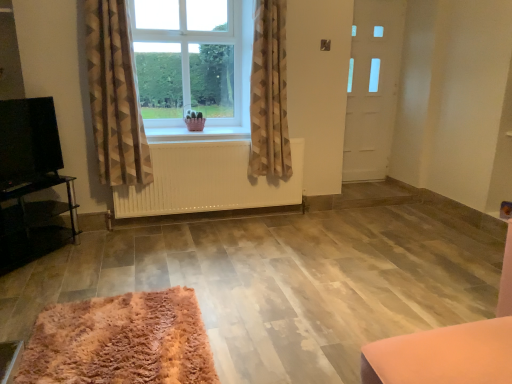
Where is `clear glass window at center`? The width and height of the screenshot is (512, 384). clear glass window at center is located at coordinates (193, 65).

What do you see at coordinates (115, 96) in the screenshot? The image size is (512, 384). I see `beige textured curtain at center, the 1th curtain in the left-to-right sequence` at bounding box center [115, 96].

This screenshot has height=384, width=512. I want to click on white matte radiator at center, so click(207, 181).

Locate an element on the screen. white matte door at right is located at coordinates (372, 87).

What do you see at coordinates (120, 341) in the screenshot?
I see `fluffy pink rug at lower left` at bounding box center [120, 341].

Image resolution: width=512 pixels, height=384 pixels. What do you see at coordinates (269, 93) in the screenshot?
I see `beige textured curtain at center, placed as the first curtain when sorted from right to left` at bounding box center [269, 93].

Measure the distance between point (187,135) and camera.

Point (187,135) is 3.42 meters away from camera.

I want to click on black glossy tv at left, so click(28, 141).

You are a GUI agent. You are given a task and a screenshot of the screen. Output one action in this format:
    pyautogui.click(x=<x>, y=<y>)
    Task: Click on the clear glass window at center
    Image resolution: width=512 pixels, height=384 pixels.
    Given the screenshot: What is the action you would take?
    pyautogui.click(x=193, y=65)

Does point (47, 316) appear closer or farther from the camera than point (39, 169)?

Clearly, point (47, 316) is closer to the camera than point (39, 169).

From the image's perspective, between fluffy pink rug at lower left and black glossy tv at left, who is located below?

fluffy pink rug at lower left is shown below in the image.

Is fluffy pink rug at lower left oriented towards black glossy tv at left?

No, fluffy pink rug at lower left is not aimed at black glossy tv at left.

I want to click on window that appears above the white matte radiator at center (from the image's perspective), so click(193, 65).

From their relative heights in the image, would you say clear glass window at center is taller or shorter than white matte radiator at center?

Clearly, clear glass window at center is taller compared to white matte radiator at center.

From the image's perspective, is clear glass window at center on white matte radiator at center?

Yes.

Consider the image. Is clear glass window at center not near white matte radiator at center?

clear glass window at center is actually quite close to white matte radiator at center.

Is beige textured curtain at center, the 1th curtain in the left-to-right sequence, oriented away from clear glass window at center?

No, beige textured curtain at center, the 1th curtain in the left-to-right sequence,'s orientation is not away from clear glass window at center.

How different are the orientations of beige textured curtain at center, marked as the 2th curtain in a right-to-left arrangement, and clear glass window at center in degrees?

The angular difference between beige textured curtain at center, marked as the 2th curtain in a right-to-left arrangement, and clear glass window at center is 0.572 degrees.

Which of these two, beige textured curtain at center, marked as the 2th curtain in a right-to-left arrangement, or clear glass window at center, is smaller?

clear glass window at center.

The image size is (512, 384). What are the coordinates of `furniture below the white matte door at right (from a real-world perspective)` in the screenshot? It's located at (35, 223).

From the image's perspective, which one is positioned lower, white matte door at right or black glossy tv stand at left?

black glossy tv stand at left is shown below in the image.

Is white matte door at right surrounding black glossy tv stand at left?

No, black glossy tv stand at left is not surrounded by white matte door at right.

Does point (144, 77) appear closer or farther from the camera than point (195, 370)?

Point (144, 77) appears to be farther away from the viewer than point (195, 370).

Which of these two, clear glass window at center or fluffy pink rug at lower left, is thinner?

clear glass window at center.

Can you confirm if clear glass window at center is shorter than fluffy pink rug at lower left?

Incorrect, the height of clear glass window at center does not fall short of that of fluffy pink rug at lower left.

Looking at this image, from the image's perspective, which object appears higher, clear glass window at center or fluffy pink rug at lower left?

clear glass window at center is shown above in the image.

From the image's perspective, is white matte door at right located above or below beige textured curtain at center, placed as the first curtain when sorted from right to left?

white matte door at right is situated higher than beige textured curtain at center, placed as the first curtain when sorted from right to left, in the image.

Is white matte door at right facing towards beige textured curtain at center, the 2th curtain from the left?

No, white matte door at right is not oriented towards beige textured curtain at center, the 2th curtain from the left.

Is white matte door at right with beige textured curtain at center, placed as the first curtain when sorted from right to left?

No, white matte door at right is not in contact with beige textured curtain at center, placed as the first curtain when sorted from right to left.

Is beige textured curtain at center, the 2th curtain from the left, inside white matte door at right?

No, beige textured curtain at center, the 2th curtain from the left, is located outside of white matte door at right.

Which of these two, white matte door at right or clear glass window at center, stands taller?

white matte door at right.

Is white matte door at right turned away from clear glass window at center?

No, white matte door at right is not facing the opposite direction of clear glass window at center.

How many degrees apart are the facing directions of white matte door at right and clear glass window at center?

0.755 degrees separate the facing orientations of white matte door at right and clear glass window at center.

Consider the image. Does white matte door at right have a greater width compared to clear glass window at center?

No.

Find the location of `mat below the black glossy tv at left (from the image's perspective)`. mat below the black glossy tv at left (from the image's perspective) is located at coordinates (120, 341).

Locate an element on the screen. This screenshot has width=512, height=384. radiator below the clear glass window at center (from a real-world perspective) is located at coordinates (207, 181).

From the image, which object appears to be farther from clear glass window at center, white wooden window sill at center or black glossy tv stand at left?

black glossy tv stand at left is positioned further to the anchor clear glass window at center.

Considering their positions, is white wooden window sill at center positioned further to black glossy tv at left than fluffy pink rug at lower left?

fluffy pink rug at lower left is further to black glossy tv at left.

Estimate the real-world distances between objects in this image. Which object is closer to beige textured curtain at center, the 1th curtain in the left-to-right sequence, white matte radiator at center or white wooden window sill at center?

white matte radiator at center lies closer to beige textured curtain at center, the 1th curtain in the left-to-right sequence, than the other object.

Looking at the image, which one is located closer to clear glass window at center, black glossy tv at left or black glossy tv stand at left?

Based on the image, black glossy tv at left appears to be nearer to clear glass window at center.

Considering their positions, is white wooden window sill at center positioned further to beige textured curtain at center, the 2th curtain from the left, than fluffy pink rug at lower left?

fluffy pink rug at lower left lies further to beige textured curtain at center, the 2th curtain from the left, than the other object.

Estimate the real-world distances between objects in this image. Which object is closer to clear glass window at center, beige textured curtain at center, placed as the first curtain when sorted from right to left, or beige textured curtain at center, the 1th curtain in the left-to-right sequence?

Based on the image, beige textured curtain at center, the 1th curtain in the left-to-right sequence, appears to be nearer to clear glass window at center.

From the image, which object appears to be farther from black glossy tv stand at left, beige textured curtain at center, the 2th curtain from the left, or black glossy tv at left?

beige textured curtain at center, the 2th curtain from the left, is positioned further to the anchor black glossy tv stand at left.

Looking at the image, which one is located closer to white matte door at right, black glossy tv at left or fluffy pink rug at lower left?

black glossy tv at left.

This screenshot has height=384, width=512. What are the coordinates of `level between beige textured curtain at center, the 1th curtain in the left-to-right sequence, and black glossy tv stand at left in the up-down direction` in the screenshot? It's located at (28, 141).

Locate an element on the screen. This screenshot has width=512, height=384. window sill situated between clear glass window at center and white matte door at right from left to right is located at coordinates (197, 133).

Identify the location of curtain between black glossy tv at left and white wooden window sill at center in the horizontal direction. The image size is (512, 384). (115, 96).

You are a GUI agent. You are given a task and a screenshot of the screen. Output one action in this format:
    pyautogui.click(x=<x>, y=<y>)
    Task: Click on the curtain situated between black glossy tv stand at left and white wooden window sill at center from left to right
    
    Given the screenshot: What is the action you would take?
    pyautogui.click(x=115, y=96)